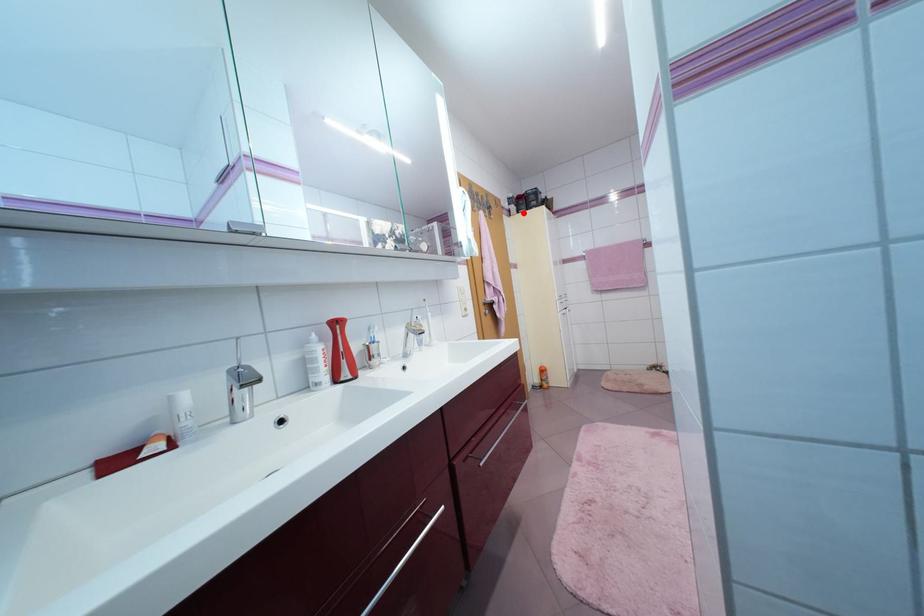
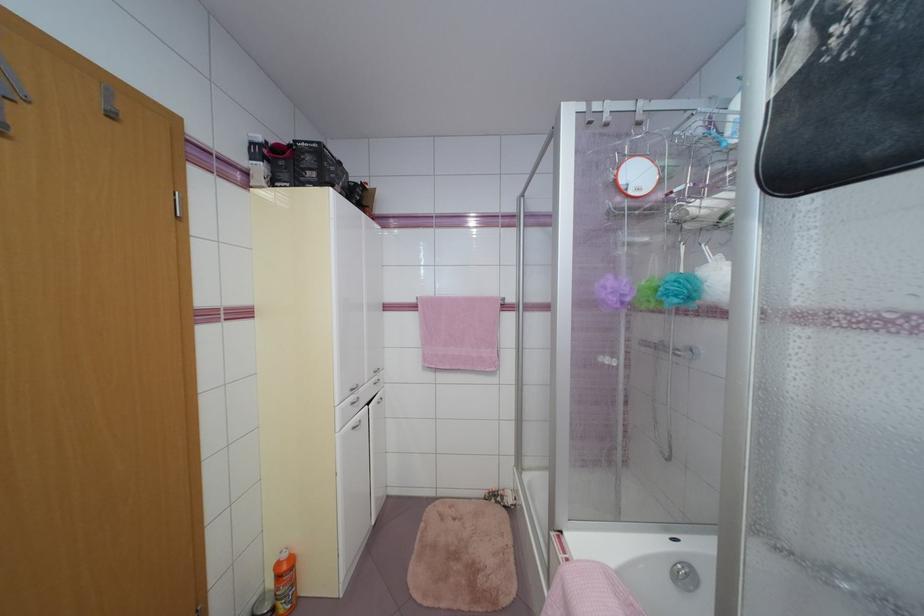
Question: I am providing you with two images of the same scene from different viewpoints. A red point is shown in image1. For the corresponding object point in image2, is it positioned nearer or farther from the camera?

Choices:
 (A) Nearer
 (B) Farther

Answer: (B)